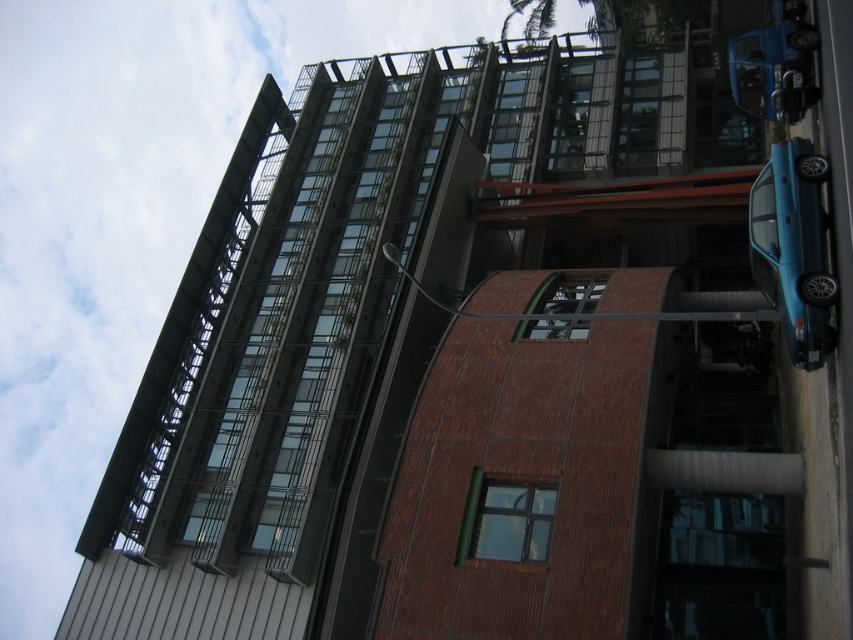
Question: Is teal glossy car at right to the left of blue matte car at upper right from the viewer's perspective?

Choices:
 (A) yes
 (B) no

Answer: (A)

Question: Is teal glossy car at right bigger than blue matte car at upper right?

Choices:
 (A) yes
 (B) no

Answer: (A)

Question: Which object appears closest to the camera in this image?

Choices:
 (A) teal glossy car at right
 (B) blue matte car at upper right

Answer: (A)

Question: Can you confirm if teal glossy car at right is positioned above blue matte car at upper right?

Choices:
 (A) yes
 (B) no

Answer: (B)

Question: Which of the following is the closest to the observer?

Choices:
 (A) blue matte car at upper right
 (B) teal glossy car at right

Answer: (B)